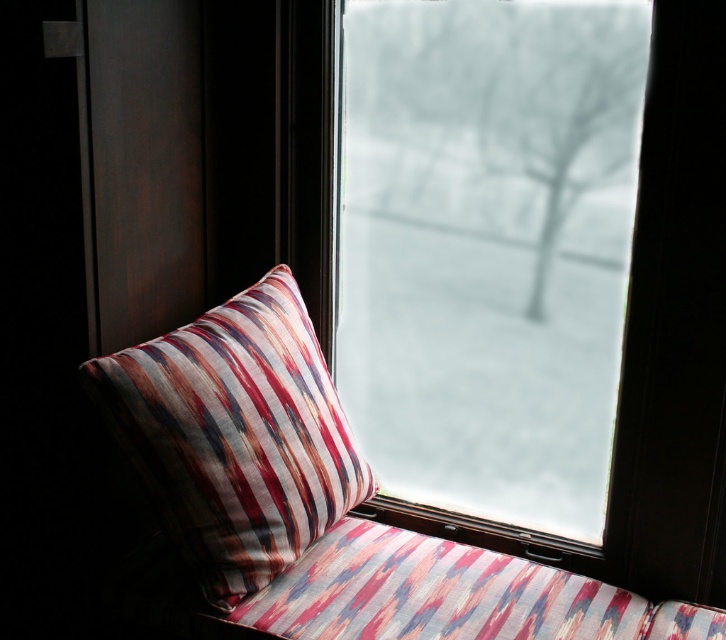
You are sitting on the window seat and want to look outside through the transparent glass window at center. Where exactly should you position your gaze to see the outdoor view clearly?

The transparent glass window at center is located at point (489,248), so you should position your gaze towards that coordinate to see the outdoor view clearly.

You are sitting on the window seat and want to place both the transparent glass window at center and the striped fabric pillow at center on a shelf. The shelf can only hold one item at a time. Which item should you place first if you want to maximize the shelf space used?

The transparent glass window at center is larger than the striped fabric pillow at center, so placing the transparent glass window at center first will allow you to utilize more shelf space before placing the smaller striped fabric pillow at center.